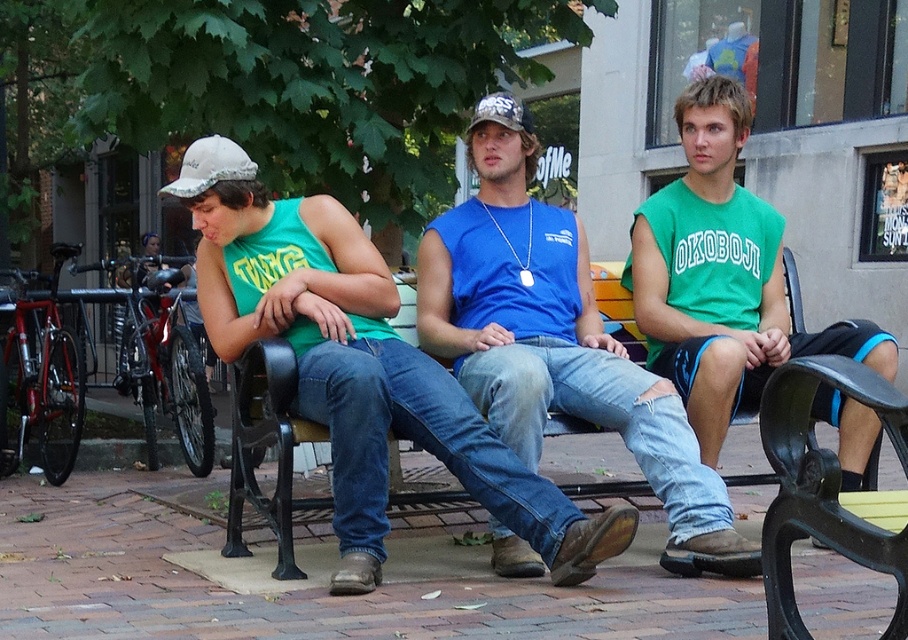
You are standing at the point labeled point (344, 362). You want to walk to a nearby park entrance that is 5 meters away from your current position. Can you reach the entrance without moving more than 5 meters?

The distance between point (344, 362) and the viewer is 4.76 meters. Since the park entrance is 5 meters away from your current position, you can reach it without moving more than 5 meters because 4.76 meters is less than 5 meters.

You are a photographer setting up a shot of the scene. You want to ensure the blue denim jeans at center and the white fabric baseball cap at left are both in focus. Which object should you focus on first to ensure both are sharp?

The blue denim jeans at center is located below the white fabric baseball cap at left, so focusing on the white fabric baseball cap at left first would ensure both are in focus since it is closer to the camera.

You are a tailor who needs to measure the blue denim jeans at center and the white fabric baseball cap at left for alterations. Which item requires more fabric to be added if you need to increase their sizes proportionally?

The blue denim jeans at center requires more fabric to be added because it has a larger size compared to the white fabric baseball cap at left.